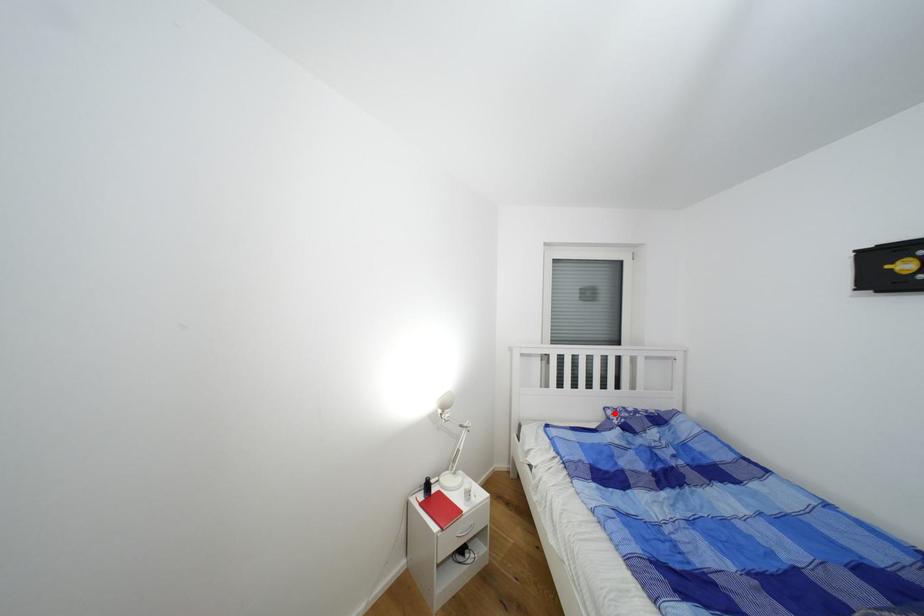
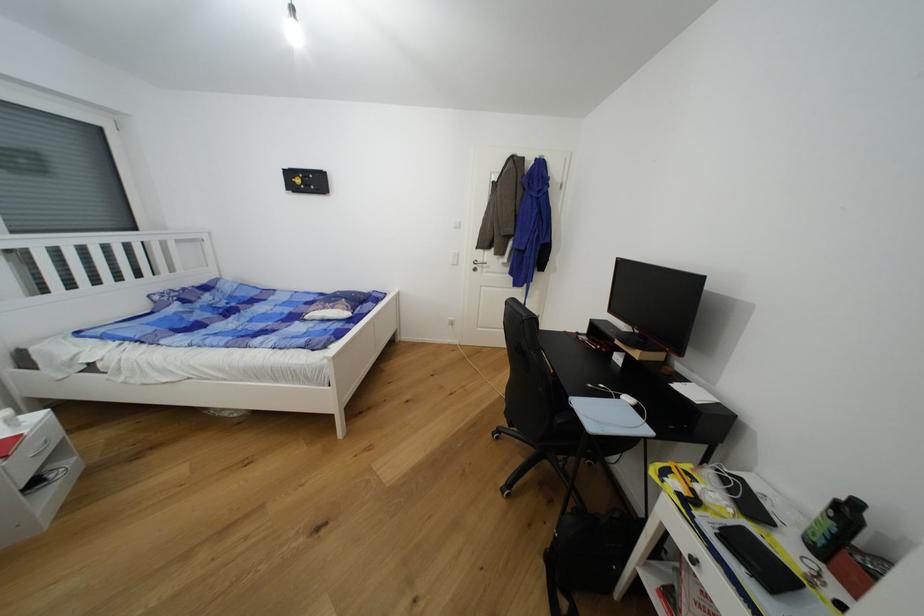
Question: I am providing you with two images of the same scene from different viewpoints. Image1 has a red point marked. In image2, the corresponding 3D location appears at what relative position? Reply with the corresponding letter.

Choices:
 (A) Closer
 (B) Farther

Answer: (A)